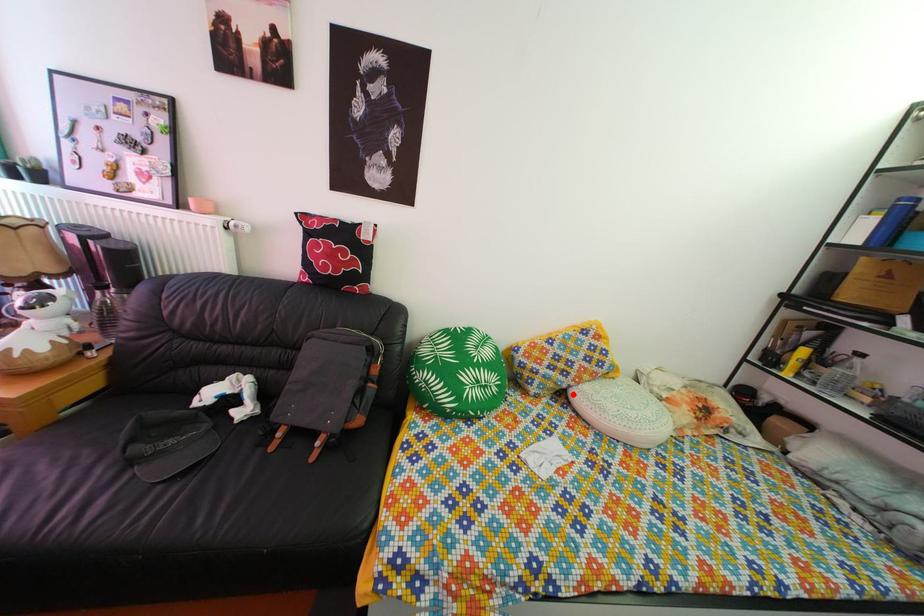
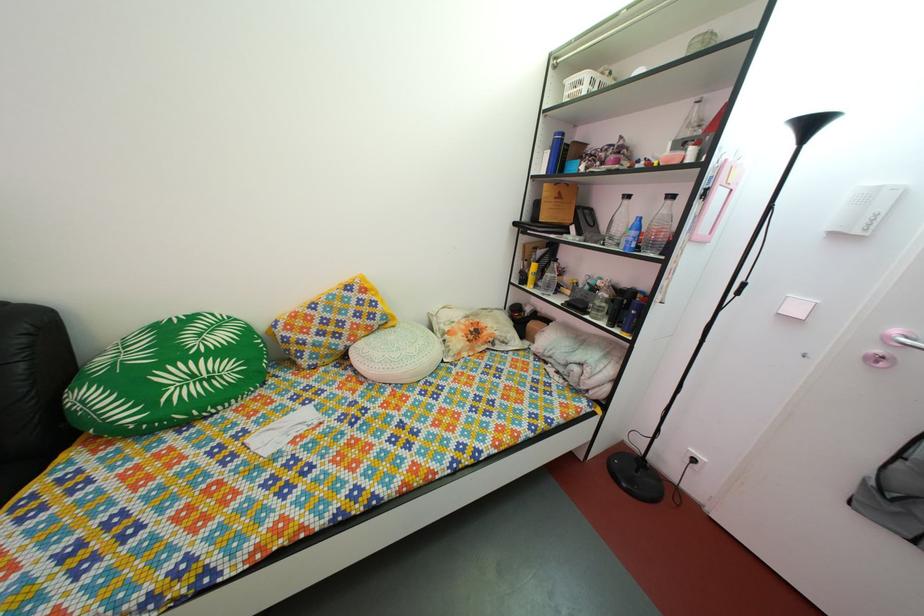
Locate, in the second image, the point that corresponds to the highlighted location in the first image.

(349, 357)